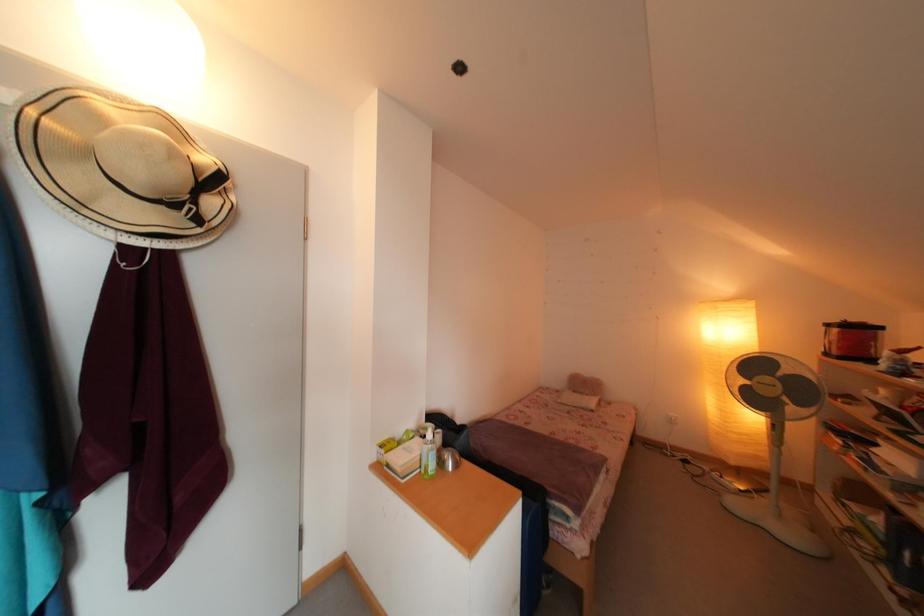
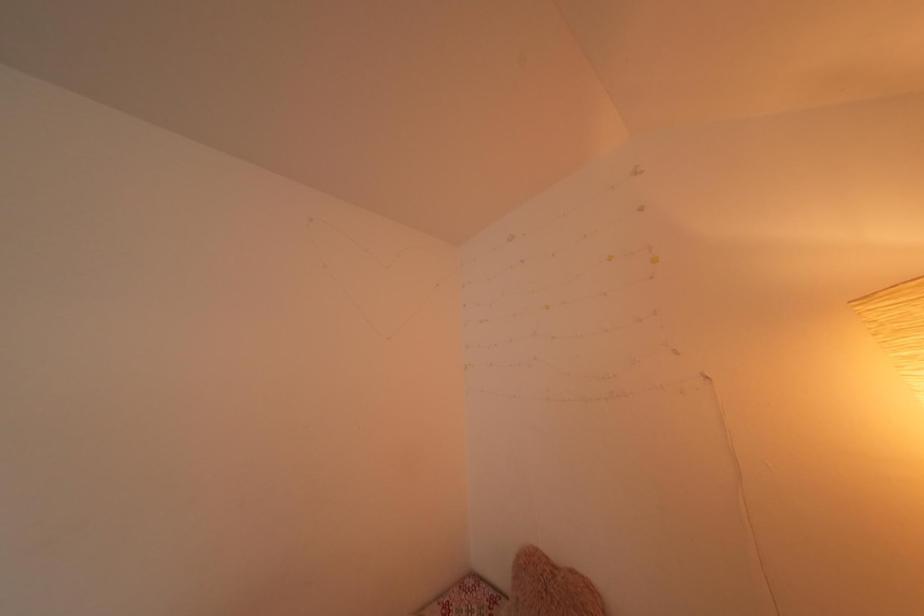
In a continuous first-person perspective shot, in which direction is the camera moving?

The cameraman moved toward right, forward.